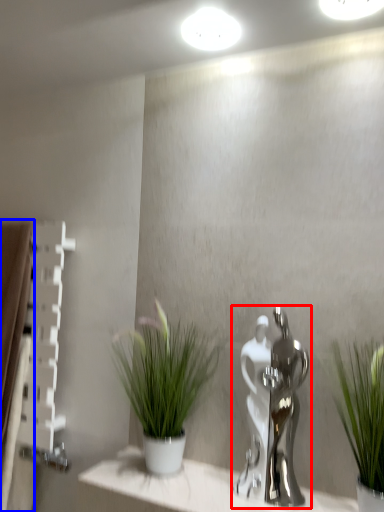
Question: Which point is closer to the camera, tap (highlighted by a red box) or curtain (highlighted by a blue box)?

Choices:
 (A) tap
 (B) curtain

Answer: (A)